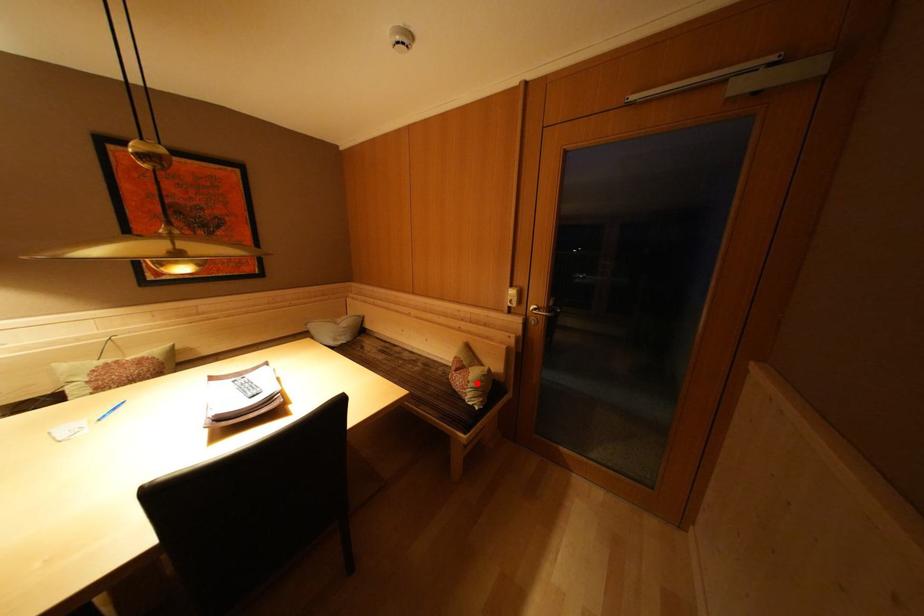
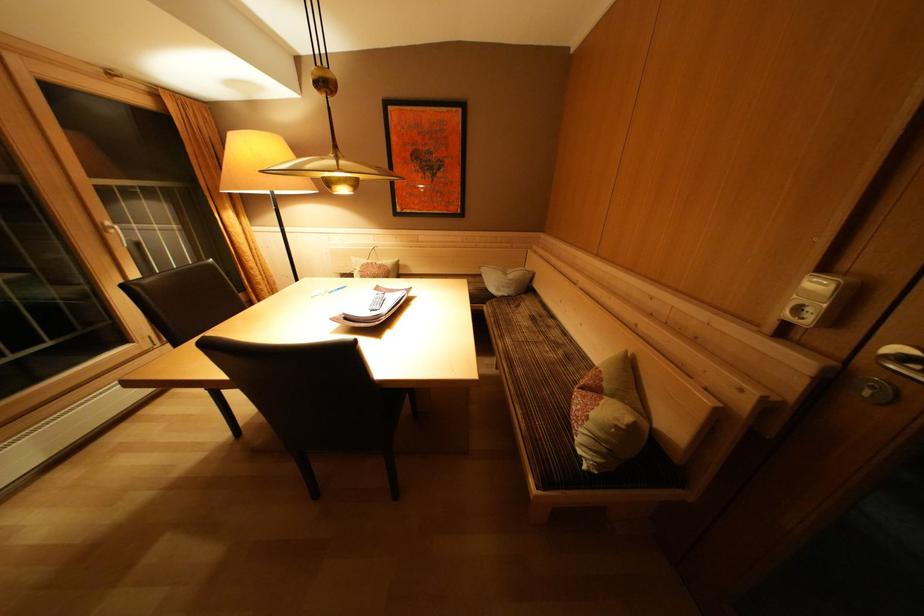
The point at the highlighted location is marked in the first image. Where is the corresponding point in the second image?

(600, 419)